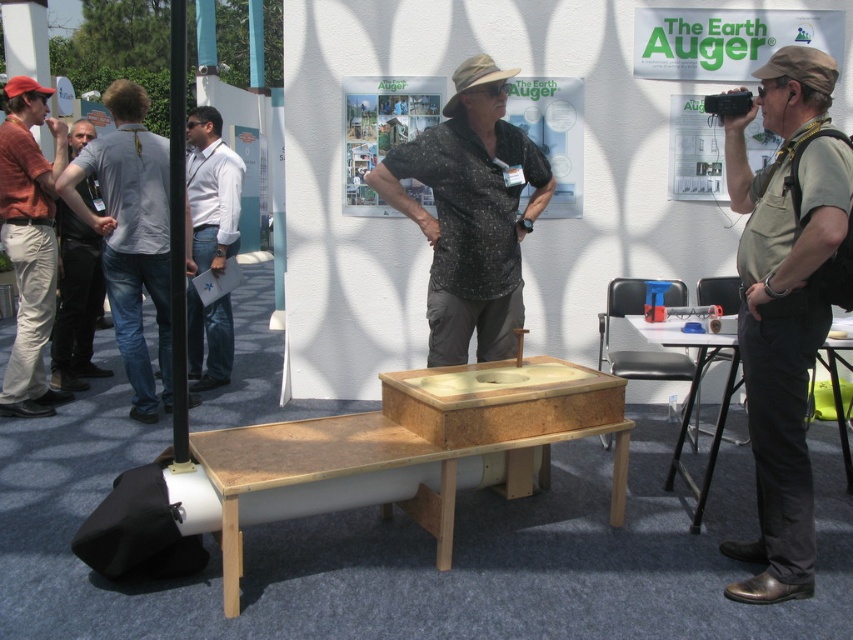
At what (x,y) coordinates should I click in order to perform the action: click on khaki fabric shirt at center. Please return your answer as a coordinate pair (x, y). The width and height of the screenshot is (853, 640). Looking at the image, I should click on (785, 301).

In the scene shown: Can you confirm if khaki fabric shirt at center is smaller than black plastic table at lower right?

Correct, khaki fabric shirt at center occupies less space than black plastic table at lower right.

You are a GUI agent. You are given a task and a screenshot of the screen. Output one action in this format:
    pyautogui.click(x=<x>, y=<y>)
    Task: Click on the khaki fabric shirt at center
    Image resolution: width=853 pixels, height=640 pixels.
    Given the screenshot: What is the action you would take?
    tap(785, 301)

Between khaki fabric shirt at center and white shirt at center, which one has more height?

white shirt at center

Does khaki fabric shirt at center appear under white shirt at center?

Correct, khaki fabric shirt at center is located below white shirt at center.

Which is in front, point (790, 416) or point (224, 244)?

Point (790, 416) is in front.

At what (x,y) coordinates should I click in order to perform the action: click on khaki fabric shirt at center. Please return your answer as a coordinate pair (x, y). This screenshot has width=853, height=640. Looking at the image, I should click on (785, 301).

Can you confirm if matte orange shirt at left is positioned to the right of white shirt at center?

No, matte orange shirt at left is not to the right of white shirt at center.

Does matte orange shirt at left have a lesser height compared to white shirt at center?

Incorrect, matte orange shirt at left's height does not fall short of white shirt at center's.

Does point (15, 179) come closer to viewer compared to point (195, 292)?

Yes, it is in front of point (195, 292).

At what (x,y) coordinates should I click in order to perform the action: click on matte orange shirt at left. Please return your answer as a coordinate pair (x, y). The height and width of the screenshot is (640, 853). Looking at the image, I should click on pyautogui.click(x=28, y=243).